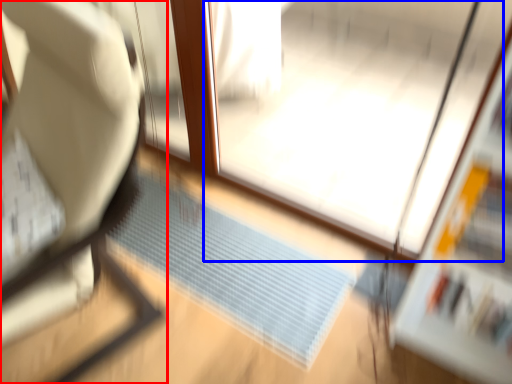
Question: Among these objects, which one is farthest to the camera, furniture (highlighted by a red box) or screen door (highlighted by a blue box)?

Choices:
 (A) furniture
 (B) screen door

Answer: (B)